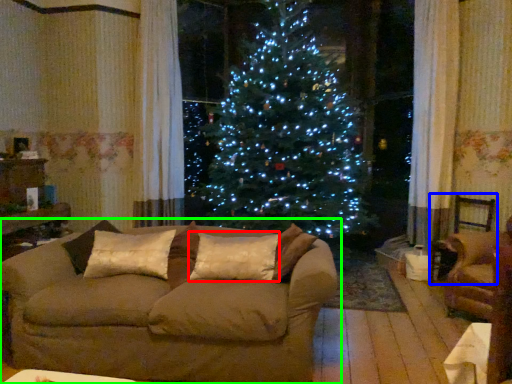
Question: Which object is positioned closest to pillow (highlighted by a red box)? Select from armchair (highlighted by a blue box) and studio couch (highlighted by a green box).

Choices:
 (A) armchair
 (B) studio couch

Answer: (B)